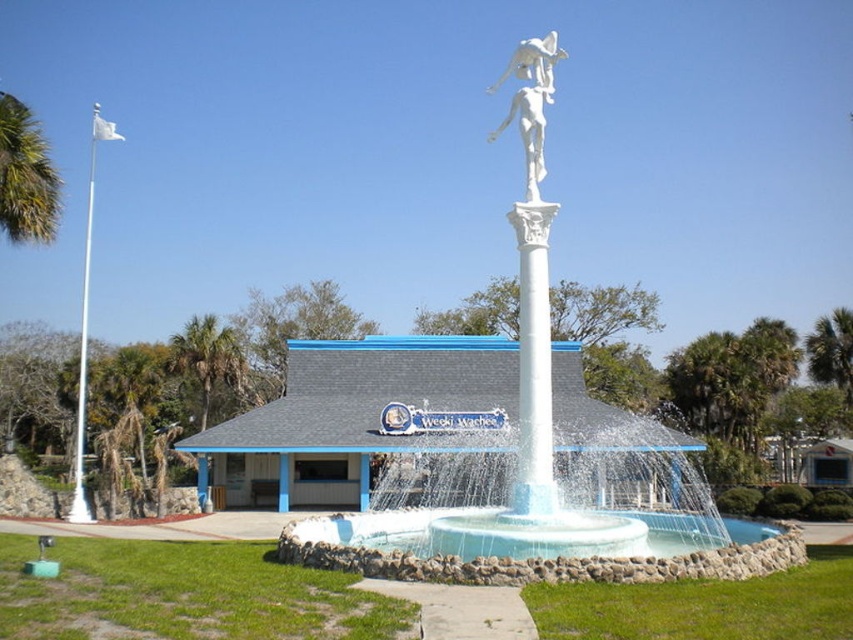
Is point (560, 502) farther from camera compared to point (544, 51)?

Yes, point (560, 502) is behind point (544, 51).

Does white marble statue at center come in front of white marble statue at upper center?

That is True.

Is point (540, 436) less distant than point (544, 67)?

Yes, it is.

Identify the location of white marble statue at center. (529, 451).

Who is taller, white marble statue at upper center or green leafy palm tree at left?

white marble statue at upper center is taller.

Does white marble statue at upper center have a greater width compared to green leafy palm tree at left?

Incorrect, white marble statue at upper center's width does not surpass green leafy palm tree at left's.

The image size is (853, 640). What do you see at coordinates (531, 100) in the screenshot?
I see `white marble statue at upper center` at bounding box center [531, 100].

The image size is (853, 640). Find the location of `white marble statue at upper center`. white marble statue at upper center is located at coordinates (531, 100).

Is green leafy palm tree at upper left positioned at the back of white marble statue at upper center?

That is True.

Who is more forward, (10, 186) or (541, 131)?

Point (541, 131) is in front.

Describe the element at coordinates (25, 177) in the screenshot. I see `green leafy palm tree at upper left` at that location.

Image resolution: width=853 pixels, height=640 pixels. What are the coordinates of `green leafy palm tree at upper left` in the screenshot? It's located at tap(25, 177).